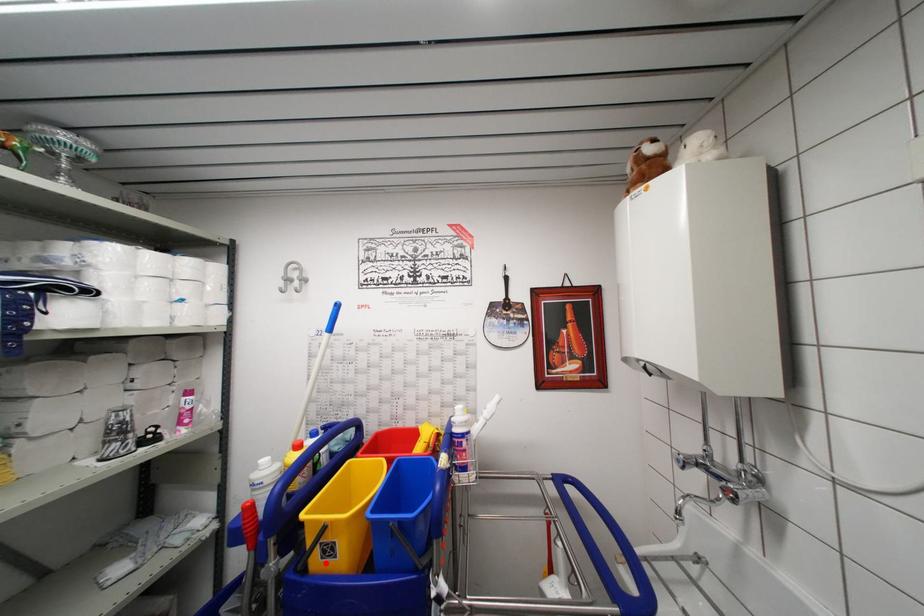
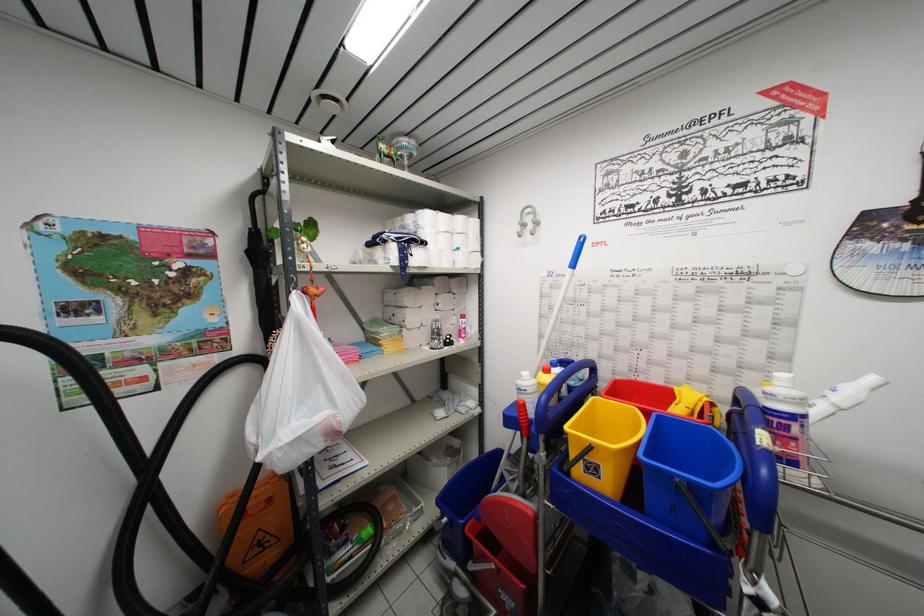
Question: I am providing you with two images of the same scene from different viewpoints. In image1, a red point is highlighted. Considering the same 3D point in image2, which of the following is correct?

Choices:
 (A) It is closer
 (B) It is farther

Answer: (A)